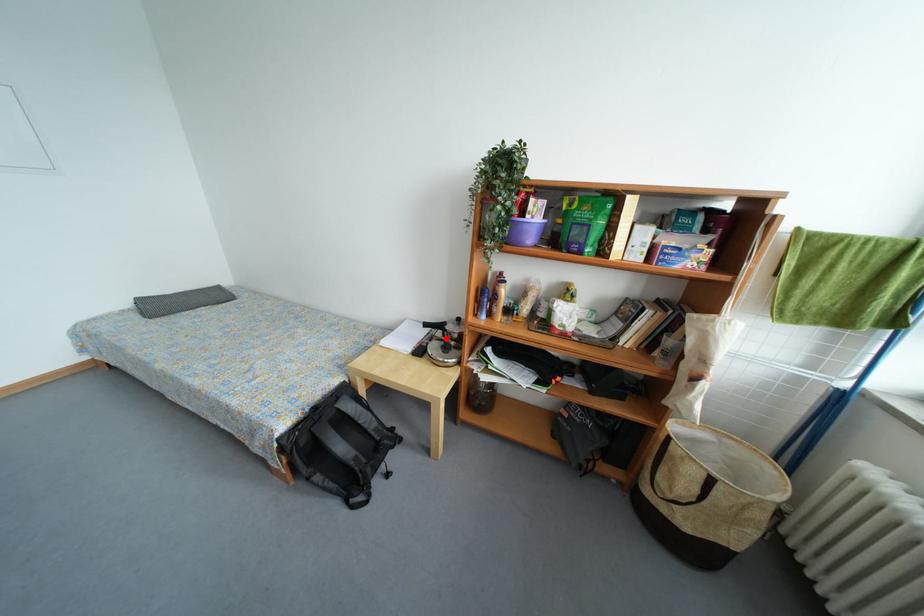
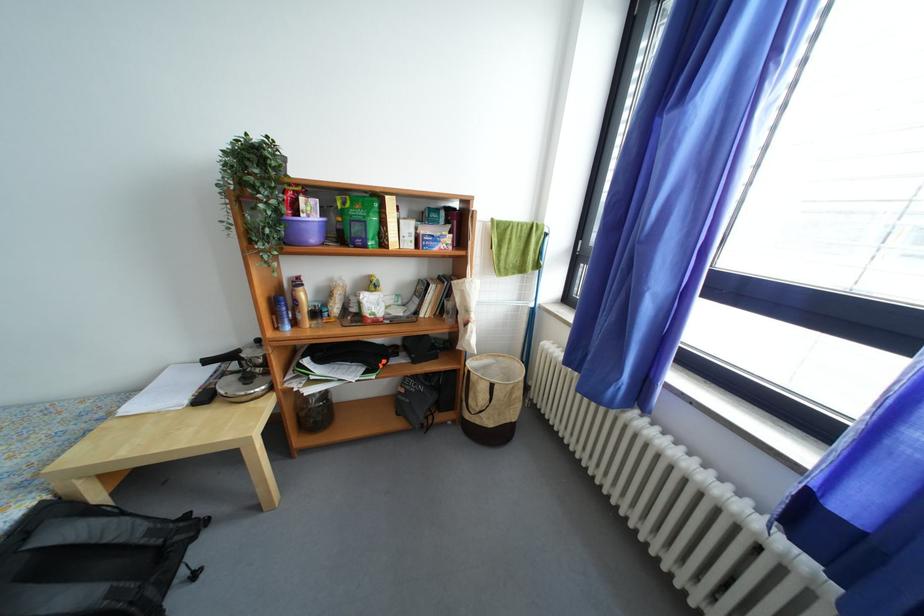
Where in the second image is the point corresponding to the highlighted location from the first image?

(240, 371)